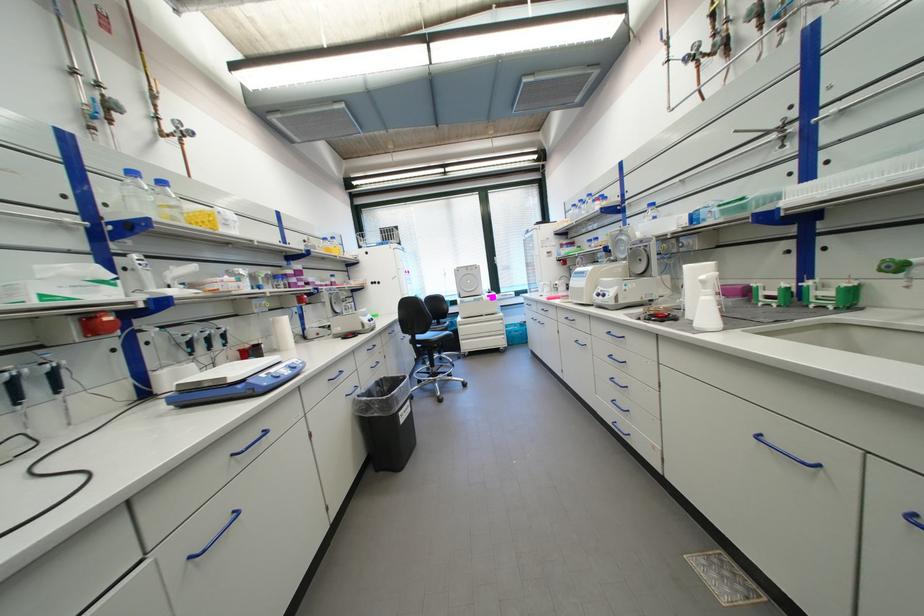
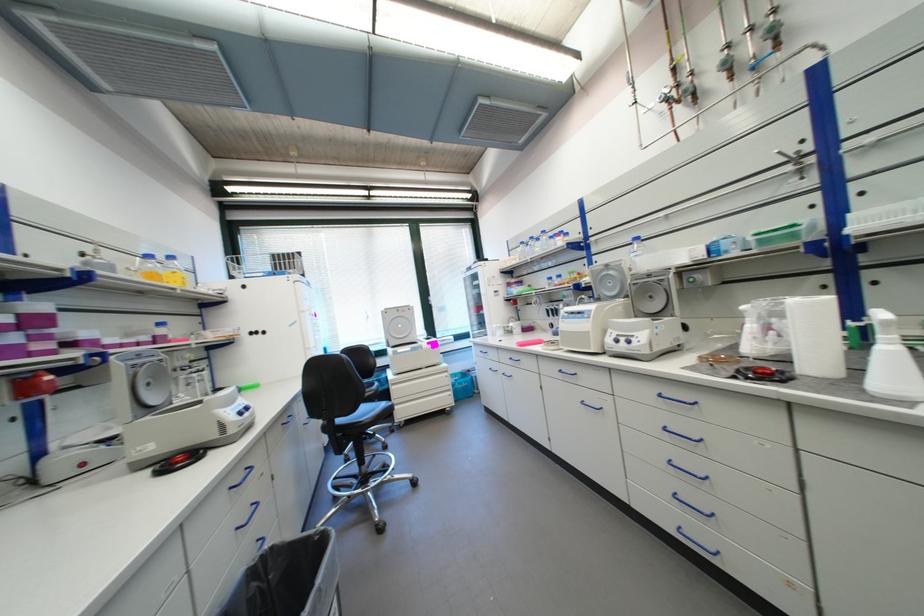
Question: The camera is either moving clockwise (left) or counter-clockwise (right) around the object. The first image is from the beginning of the video and the second image is from the end. Is the camera moving left or right when shooting the video?

Choices:
 (A) Left
 (B) Right

Answer: (A)